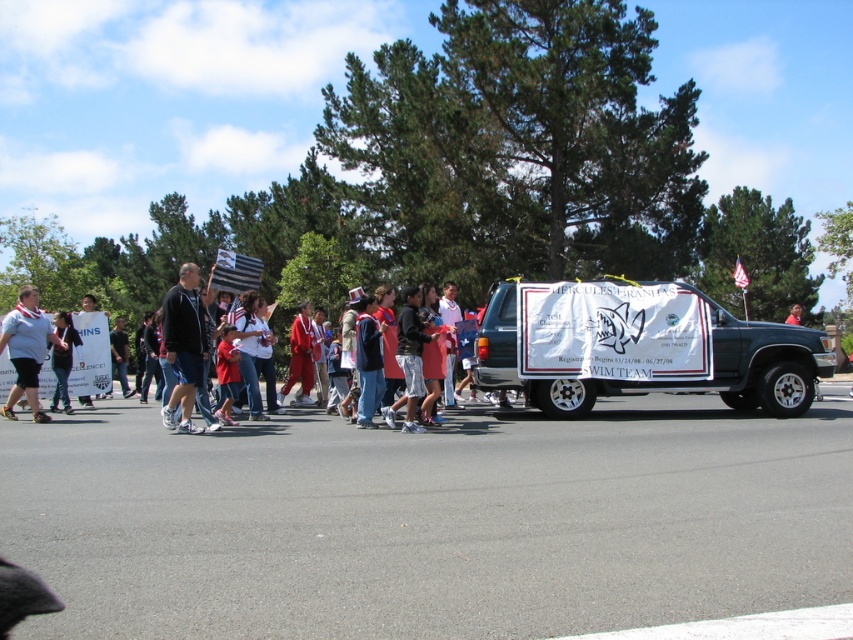
Does point (589, 403) lie in front of point (798, 310)?

Yes, point (589, 403) is in front of point (798, 310).

Which of these two, white vinyl banner at center or red fabric sign at center, stands shorter?

white vinyl banner at center is shorter.

Is point (808, 348) positioned after point (791, 312)?

No.

The image size is (853, 640). I want to click on white vinyl banner at center, so coord(668,380).

Does matte gray shirt at left lie behind white fabric flag at center?

No.

Who is positioned more to the left, matte gray shirt at left or white fabric flag at center?

From the viewer's perspective, matte gray shirt at left appears more on the left side.

Who is more distant from viewer, (27, 396) or (210, 280)?

The point (210, 280) is behind.

Identify the location of matte gray shirt at left. The image size is (853, 640). (26, 349).

Based on the photo, can you confirm if matte black jacket at center is bigger than american flag at center?

Actually, matte black jacket at center might be smaller than american flag at center.

Does matte black jacket at center have a lesser width compared to american flag at center?

Yes, matte black jacket at center is thinner than american flag at center.

I want to click on matte black jacket at center, so click(91, 355).

The width and height of the screenshot is (853, 640). Find the location of `matte black jacket at center`. matte black jacket at center is located at coordinates (91, 355).